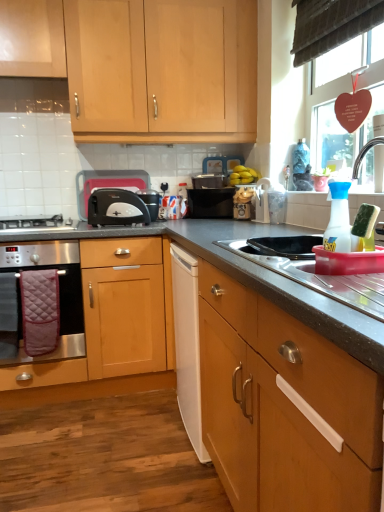
Question: Could you tell me if dark gray laminate countertop at center is facing satin silver gas stove at lower left?

Choices:
 (A) yes
 (B) no

Answer: (B)

Question: Is dark gray laminate countertop at center smaller than satin silver gas stove at lower left?

Choices:
 (A) yes
 (B) no

Answer: (B)

Question: Is dark gray laminate countertop at center turned away from satin silver gas stove at lower left?

Choices:
 (A) no
 (B) yes

Answer: (A)

Question: Would you consider dark gray laminate countertop at center to be distant from satin silver gas stove at lower left?

Choices:
 (A) yes
 (B) no

Answer: (B)

Question: Is satin silver gas stove at lower left completely or partially inside dark gray laminate countertop at center?

Choices:
 (A) no
 (B) yes

Answer: (A)

Question: Is dark gray laminate countertop at center completely or partially outside of satin silver gas stove at lower left?

Choices:
 (A) no
 (B) yes

Answer: (B)

Question: Is transparent plastic spray bottle at right, placed as the 2th appliance when sorted from front to back, completely or partially inside satin silver gas stove at lower left?

Choices:
 (A) yes
 (B) no

Answer: (B)

Question: Does satin silver gas stove at lower left have a greater height compared to transparent plastic spray bottle at right, the 4th appliance in the back-to-front sequence?

Choices:
 (A) no
 (B) yes

Answer: (A)

Question: Is satin silver gas stove at lower left directly adjacent to transparent plastic spray bottle at right, placed as the 2th appliance when sorted from front to back?

Choices:
 (A) yes
 (B) no

Answer: (B)

Question: From the image's perspective, would you say satin silver gas stove at lower left is shown under transparent plastic spray bottle at right, the 4th appliance in the back-to-front sequence?

Choices:
 (A) no
 (B) yes

Answer: (A)

Question: Is satin silver gas stove at lower left thinner than transparent plastic spray bottle at right, the 4th appliance in the back-to-front sequence?

Choices:
 (A) yes
 (B) no

Answer: (B)

Question: Considering the relative positions of satin silver gas stove at lower left and transparent plastic spray bottle at right, placed as the 2th appliance when sorted from front to back, in the image provided, is satin silver gas stove at lower left to the left of transparent plastic spray bottle at right, placed as the 2th appliance when sorted from front to back, from the viewer's perspective?

Choices:
 (A) no
 (B) yes

Answer: (B)

Question: Considering the relative positions of silver metallic faucet at upper right and yellow matte bananas at upper center in the image provided, is silver metallic faucet at upper right to the left of yellow matte bananas at upper center from the viewer's perspective?

Choices:
 (A) yes
 (B) no

Answer: (B)